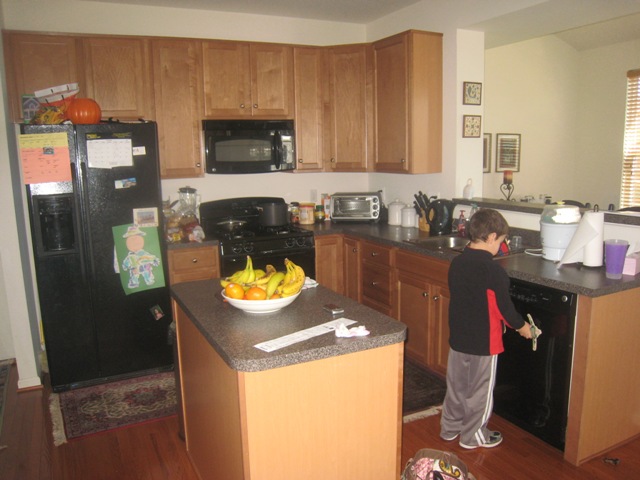
I want to click on oven cooker, so click(288, 243).